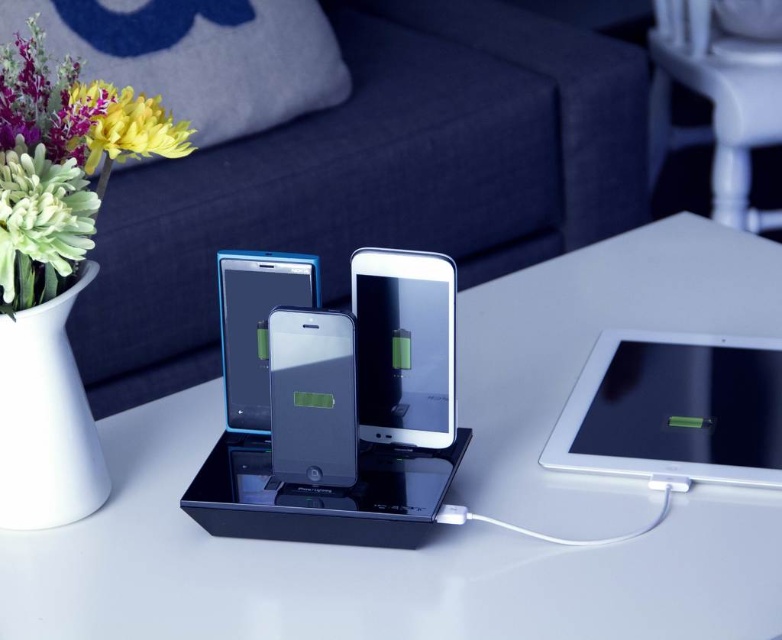
Is point (144, 600) in front of point (296, 374)?

Yes.

Which is in front, point (598, 556) or point (271, 358)?

Positioned in front is point (598, 556).

Which is behind, point (531, 554) or point (350, 378)?

Point (531, 554)

Where is `white glossy table at center`? This screenshot has height=640, width=782. white glossy table at center is located at coordinates (372, 566).

Can you confirm if dark blue fabric couch at upper center is positioned above green glossy flower at upper left?

Yes.

Between point (124, 200) and point (22, 241), which one is positioned in front?

Point (22, 241) is in front.

Where is `dark blue fabric couch at upper center`? This screenshot has width=782, height=640. dark blue fabric couch at upper center is located at coordinates (375, 179).

Looking at this image, does white matte vase at upper left come behind green glossy flower at upper left?

No, white matte vase at upper left is in front of green glossy flower at upper left.

Who is shorter, white matte vase at upper left or green glossy flower at upper left?

green glossy flower at upper left

Between point (27, 193) and point (40, 257), which one is positioned in front?

Point (27, 193) is in front.

In order to click on white matte vase at upper left in this screenshot , I will do `click(61, 163)`.